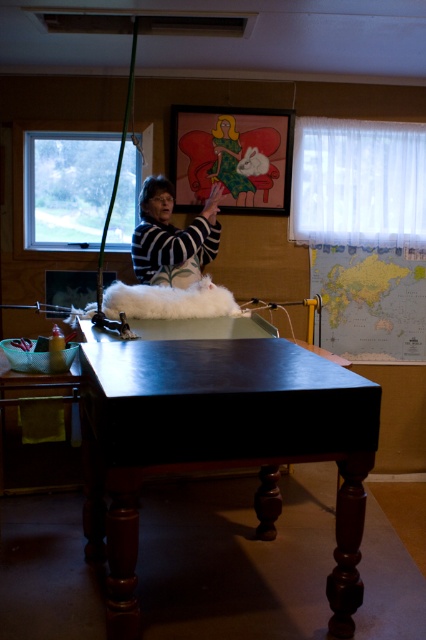
You are a visitor in the room and want to place a small vase on the shiny dark wood table at center. The striped sweater at center is currently on the table. Can the vase fit on the table without moving the sweater?

The shiny dark wood table at center might be wider than striped sweater at center, so there could be enough space to place the vase without moving the sweater. However, since the exact dimensions aren not provided, it is uncertain.

You are standing in the room and want to move from the shiny dark wood table at center to the striped sweater at center. Which direction should you move?

The shiny dark wood table at center is to the right of the striped sweater at center, so you should move to the left to reach the striped sweater at center.

What object is located at the coordinates point [219,444] in the image?

The point [219,444] marks the shiny dark wood table at center.